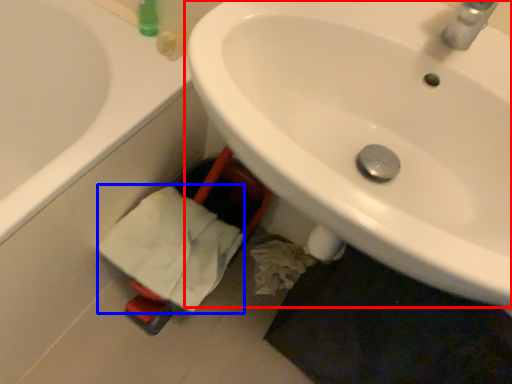
Question: Among these objects, which one is farthest to the camera, sink (highlighted by a red box) or bath towel (highlighted by a blue box)?

Choices:
 (A) sink
 (B) bath towel

Answer: (B)